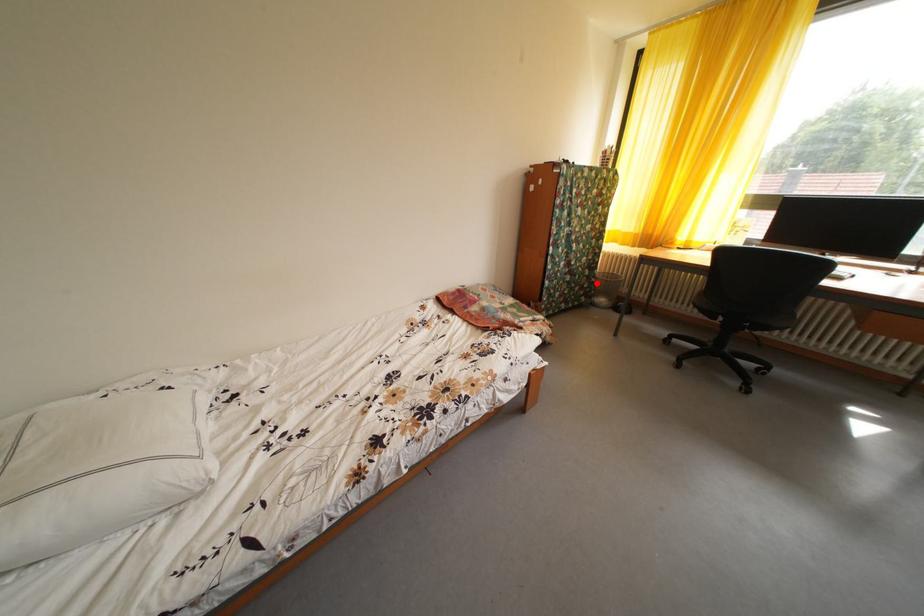
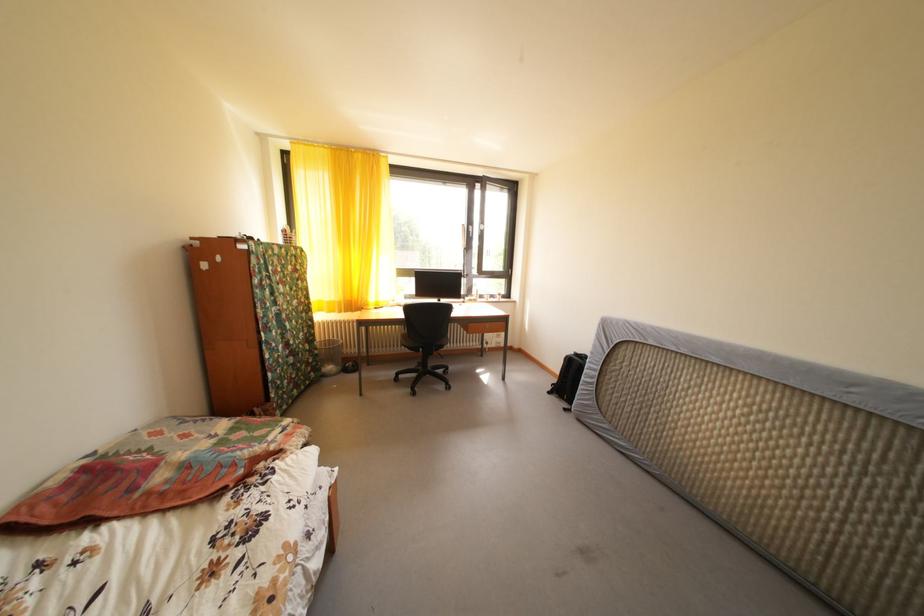
Question: I am providing you with two images of the same scene from different viewpoints. A red point is marked on the first image. Is the red point's position out of view in image 2?

Choices:
 (A) Yes
 (B) No

Answer: (B)